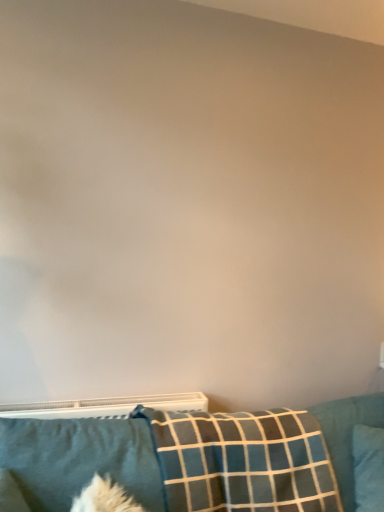
Question: Considering their positions, is blue fabric pillow at lower right, which is counted as the first pillow, starting from the right, located in front of or behind soft blue fabric pillow at lower left, which ranks as the first pillow in left-to-right order?

Choices:
 (A) behind
 (B) front

Answer: (A)

Question: From the image's perspective, is blue fabric pillow at lower right, which is counted as the first pillow, starting from the right, located above or below soft blue fabric pillow at lower left, which ranks as the first pillow in left-to-right order?

Choices:
 (A) below
 (B) above

Answer: (A)

Question: Which object is the farthest from the soft blue fabric pillow at lower left, acting as the 3th pillow starting from the right?

Choices:
 (A) plaid fabric pillow at lower center, the second pillow positioned from the left
 (B) teal fabric couch at lower center
 (C) blue fabric pillow at lower right, which appears as the third pillow when viewed from the left

Answer: (C)

Question: Which of these objects is positioned farthest from the plaid fabric pillow at lower center, acting as the second pillow starting from the right?

Choices:
 (A) soft blue fabric pillow at lower left, acting as the 3th pillow starting from the right
 (B) blue fabric pillow at lower right, which is counted as the first pillow, starting from the right
 (C) teal fabric couch at lower center

Answer: (B)